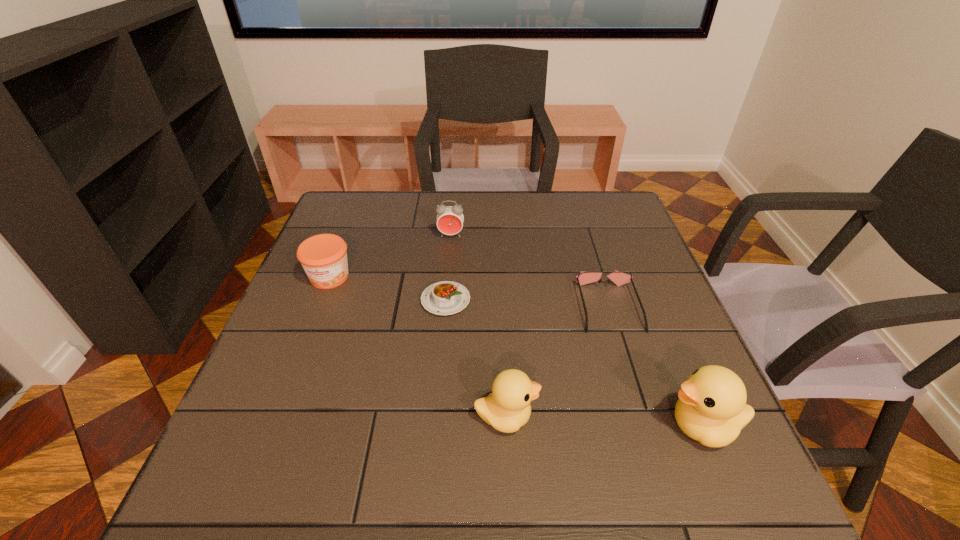
Find the location of a particular element. The image size is (960, 540). the left duck is located at coordinates (507, 408).

I want to click on the shorter duck, so pyautogui.click(x=507, y=408).

Image resolution: width=960 pixels, height=540 pixels. In order to click on the taller duck in this screenshot , I will do `click(711, 409)`.

Identify the location of the tallest object. The height and width of the screenshot is (540, 960). (711, 409).

Where is `alarm clock`? alarm clock is located at coordinates (450, 219).

At what (x,y) coordinates should I click in order to perform the action: click on sunglasses. Please return your answer as a coordinate pair (x, y). Looking at the image, I should click on (619, 278).

Locate an element on the screen. jam is located at coordinates (323, 257).

Find the location of `the leftmost object`. the leftmost object is located at coordinates (323, 257).

Identify the location of the shortest object. (447, 297).

You are a GUI agent. You are given a task and a screenshot of the screen. Output one action in this format:
    pyautogui.click(x=<x>, y=<y>)
    Task: Click on the vacant space located 0.250m on the face of the shorter duck
    
    Given the screenshot: What is the action you would take?
    tap(669, 417)